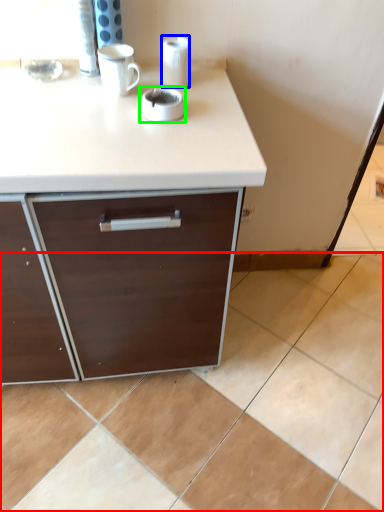
Question: Which is farther away from ceramic tile (highlighted by a red box)? paper towel (highlighted by a blue box) or appliance (highlighted by a green box)?

Choices:
 (A) paper towel
 (B) appliance

Answer: (A)